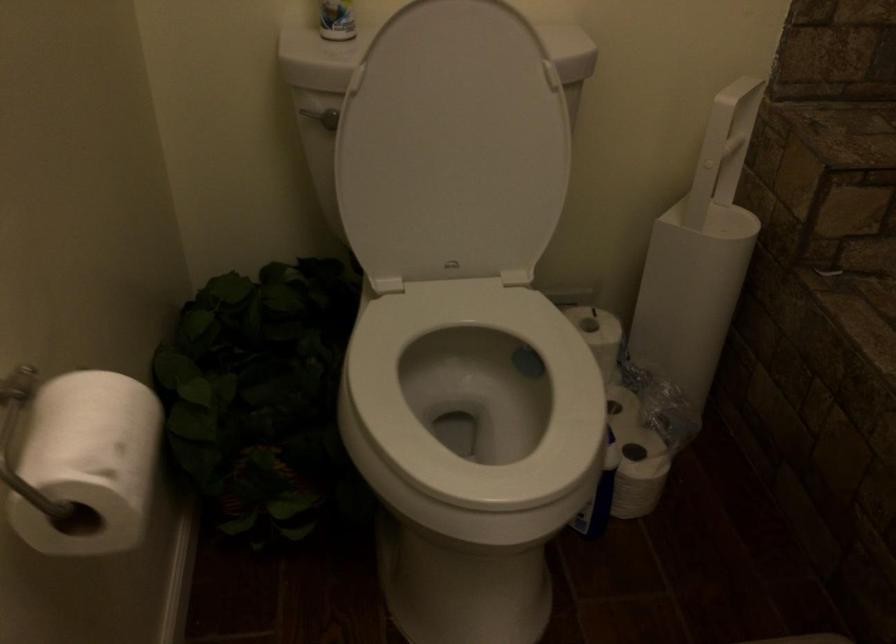
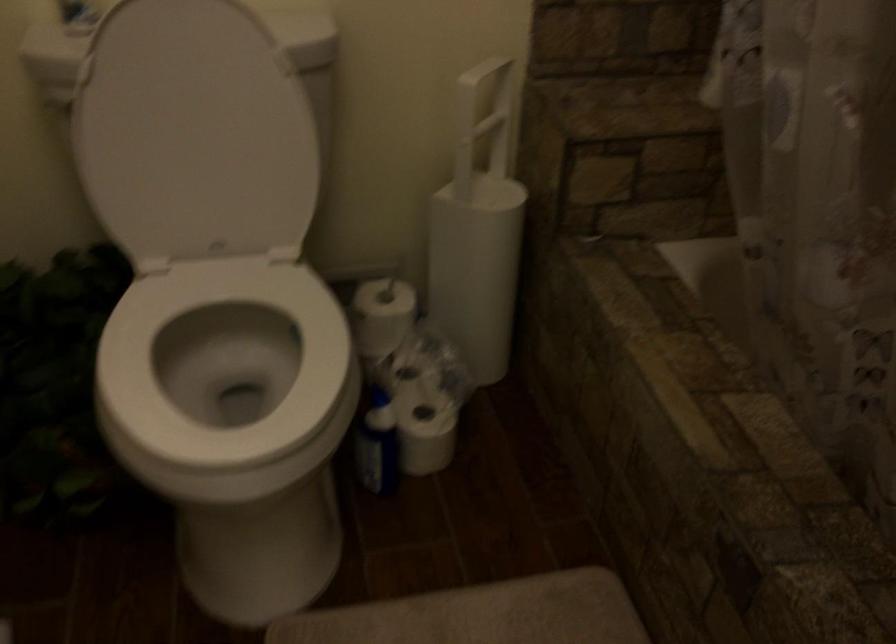
The point at (x=435, y=390) is marked in the first image. Where is the corresponding point in the second image?

(224, 365)